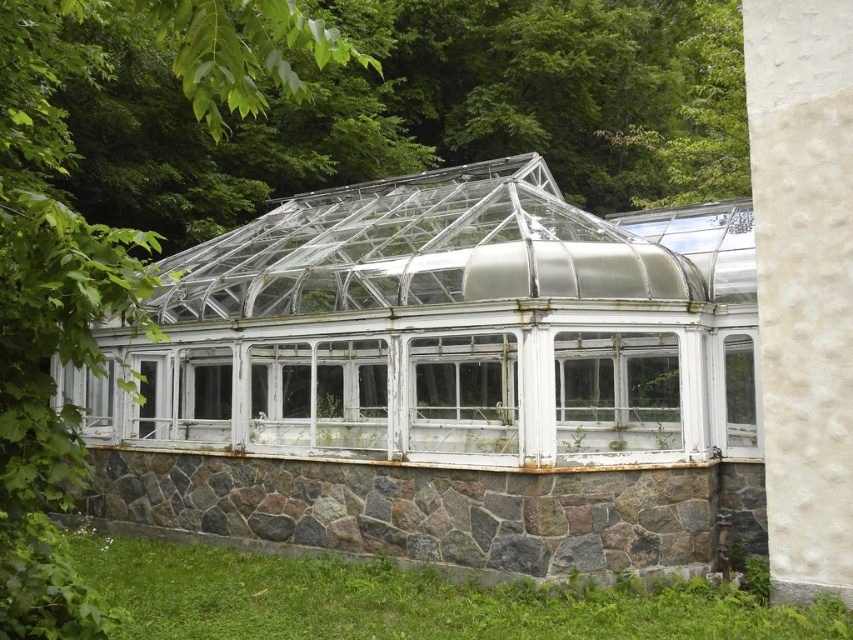
Between green grass at lower left and transparent glass window at center, which one appears on the left side from the viewer's perspective?

Positioned to the left is green grass at lower left.

Is point (184, 605) positioned before point (556, 401)?

Yes.

The height and width of the screenshot is (640, 853). What do you see at coordinates (412, 600) in the screenshot?
I see `green grass at lower left` at bounding box center [412, 600].

Where is `green grass at lower left`? This screenshot has height=640, width=853. green grass at lower left is located at coordinates (412, 600).

Who is taller, transparent glass window at center or white textured glass window at center?

white textured glass window at center

I want to click on transparent glass window at center, so click(616, 392).

This screenshot has height=640, width=853. In order to click on transparent glass window at center in this screenshot , I will do `click(616, 392)`.

Between transparent glass window at center and white wooden window at center, which one appears on the left side from the viewer's perspective?

white wooden window at center is more to the left.

Between point (670, 433) and point (265, 416), which one is positioned in front?

Positioned in front is point (670, 433).

The width and height of the screenshot is (853, 640). I want to click on transparent glass window at center, so click(616, 392).